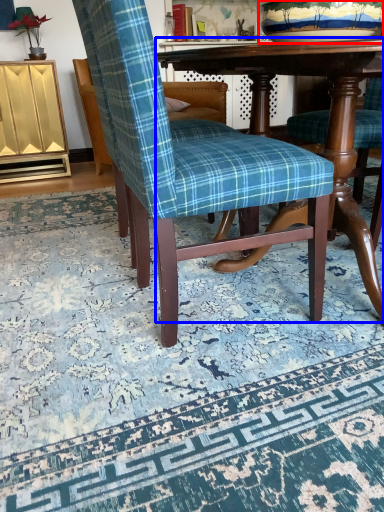
Question: Which object appears farthest to the camera in this image, bowl (highlighted by a red box) or table (highlighted by a blue box)?

Choices:
 (A) bowl
 (B) table

Answer: (A)